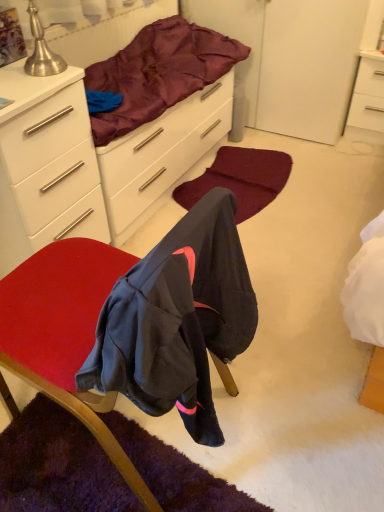
Image resolution: width=384 pixels, height=512 pixels. What do you see at coordinates (240, 179) in the screenshot? I see `burgundy carpet at center` at bounding box center [240, 179].

This screenshot has height=512, width=384. What do you see at coordinates (46, 165) in the screenshot?
I see `white matte cabinet at upper left` at bounding box center [46, 165].

Find the location of `silky purple blanket at upper center`. silky purple blanket at upper center is located at coordinates (159, 73).

What are the coordinates of `burgundy carpet at center` in the screenshot? It's located at (240, 179).

Considering the relative sizes of burgundy carpet at center and white glossy nightstand at upper right in the image provided, is burgundy carpet at center thinner than white glossy nightstand at upper right?

No, burgundy carpet at center is not thinner than white glossy nightstand at upper right.

Is there a large distance between burgundy carpet at center and white glossy nightstand at upper right?

No, burgundy carpet at center is in close proximity to white glossy nightstand at upper right.

Identify the location of mat lying on the left of white glossy nightstand at upper right. This screenshot has height=512, width=384. coord(240,179).

Is silky purple blanket at upper center to the left or to the right of burgundy carpet at center in the image?

silky purple blanket at upper center is positioned on burgundy carpet at center's left side.

Is silky purple blanket at upper center oriented away from burgundy carpet at center?

No, silky purple blanket at upper center is not facing away from burgundy carpet at center.

Consider the image. From the image's perspective, relative to burgundy carpet at center, is silky purple blanket at upper center above or below?

From the image's perspective, silky purple blanket at upper center appears above burgundy carpet at center.

Is silky purple blanket at upper center closer to the viewer compared to burgundy carpet at center?

Yes, it is.

Between point (372, 73) and point (4, 242), which one is positioned behind?

The point (372, 73) is behind.

Considering the relative positions of white glossy nightstand at upper right and white matte cabinet at upper left in the image provided, is white glossy nightstand at upper right to the left or to the right of white matte cabinet at upper left?

Clearly, white glossy nightstand at upper right is on the right of white matte cabinet at upper left in the image.

Find the location of a particular element. This screenshot has height=512, width=384. cabinetry below the white glossy nightstand at upper right (from the image's perspective) is located at coordinates (46, 165).

Is white glossy nightstand at upper right situated inside silky purple blanket at upper center or outside?

white glossy nightstand at upper right exists outside the volume of silky purple blanket at upper center.

Can you see white glossy nightstand at upper right touching silky purple blanket at upper center?

No, white glossy nightstand at upper right is not touching silky purple blanket at upper center.

Which of these two, white glossy nightstand at upper right or silky purple blanket at upper center, is smaller?

Smaller between the two is white glossy nightstand at upper right.

Who is shorter, white glossy nightstand at upper right or silky purple blanket at upper center?

With less height is silky purple blanket at upper center.

Does burgundy carpet at center have a lesser width compared to silky purple blanket at upper center?

No, burgundy carpet at center is not thinner than silky purple blanket at upper center.

Does burgundy carpet at center come behind silky purple blanket at upper center?

Yes, burgundy carpet at center is behind silky purple blanket at upper center.

Is burgundy carpet at center to the right of silky purple blanket at upper center from the viewer's perspective?

Correct, you'll find burgundy carpet at center to the right of silky purple blanket at upper center.

In terms of height, does white glossy nightstand at upper right look taller or shorter compared to velvet-like red chair at center?

white glossy nightstand at upper right is shorter than velvet-like red chair at center.

Is white glossy nightstand at upper right next to velvet-like red chair at center and touching it?

No, white glossy nightstand at upper right is not beside velvet-like red chair at center.

Is white glossy nightstand at upper right smaller than velvet-like red chair at center?

Correct, white glossy nightstand at upper right occupies less space than velvet-like red chair at center.

The image size is (384, 512). Find the location of `nightstand that is behind the velvet-like red chair at center`. nightstand that is behind the velvet-like red chair at center is located at coordinates (367, 101).

Can you confirm if white matte cabinet at upper left is smaller than burgundy carpet at center?

No, white matte cabinet at upper left is not smaller than burgundy carpet at center.

Is point (59, 95) behind point (238, 211)?

No, it is not.

Between white matte cabinet at upper left and burgundy carpet at center, which one has smaller width?

burgundy carpet at center is thinner.

Looking at this image, what's the angular difference between white matte cabinet at upper left and burgundy carpet at center's facing directions?

white matte cabinet at upper left and burgundy carpet at center are facing 0.964 degrees away from each other.

Identify the location of mat below the white glossy nightstand at upper right (from the image's perspective). (240, 179).

Identify the location of mat below the silky purple blanket at upper center (from a real-world perspective). The image size is (384, 512). (240, 179).

Based on their spatial positions, is white matte cabinet at upper left or burgundy carpet at center further from white glossy nightstand at upper right?

white matte cabinet at upper left lies further to white glossy nightstand at upper right than the other object.

Considering their positions, is silky purple blanket at upper center positioned closer to burgundy carpet at center than white matte cabinet at upper left?

silky purple blanket at upper center.

Based on their spatial positions, is velvet-like red chair at center or burgundy carpet at center further from white glossy nightstand at upper right?

Based on the image, velvet-like red chair at center appears to be further to white glossy nightstand at upper right.

Which object lies further to the anchor point velvet-like red chair at center, white matte cabinet at upper left or silky purple blanket at upper center?

Based on the image, silky purple blanket at upper center appears to be further to velvet-like red chair at center.

From the picture: Which object lies further to the anchor point white glossy nightstand at upper right, silky purple blanket at upper center or white matte cabinet at upper left?

Based on the image, white matte cabinet at upper left appears to be further to white glossy nightstand at upper right.

From the image, which object appears to be farther from burgundy carpet at center, velvet-like red chair at center or white glossy nightstand at upper right?

Based on the image, velvet-like red chair at center appears to be further to burgundy carpet at center.

Looking at the image, which one is located further to silky purple blanket at upper center, white glossy nightstand at upper right or white matte cabinet at upper left?

Based on the image, white glossy nightstand at upper right appears to be further to silky purple blanket at upper center.

Which object lies nearer to the anchor point white glossy nightstand at upper right, velvet-like red chair at center or silky purple blanket at upper center?

The object closer to white glossy nightstand at upper right is silky purple blanket at upper center.

Where is `bedding situated between white matte cabinet at upper left and white glossy nightstand at upper right from left to right`? The image size is (384, 512). bedding situated between white matte cabinet at upper left and white glossy nightstand at upper right from left to right is located at coordinates (159, 73).

This screenshot has height=512, width=384. I want to click on cabinetry that lies between silky purple blanket at upper center and velvet-like red chair at center from top to bottom, so click(x=46, y=165).

Image resolution: width=384 pixels, height=512 pixels. In order to click on bedding between white matte cabinet at upper left and burgundy carpet at center along the z-axis in this screenshot , I will do [159, 73].

What are the coordinates of `bedding located between velvet-like red chair at center and burgundy carpet at center in the depth direction` in the screenshot? It's located at (159, 73).